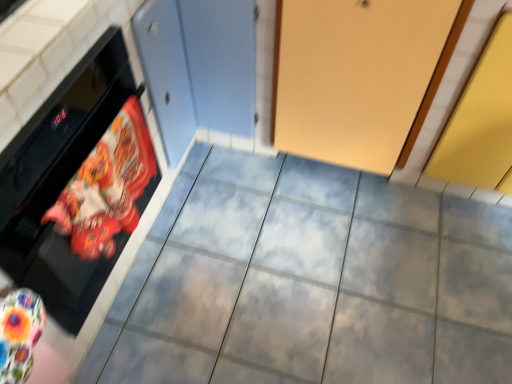
Question: Is printed fabric oven mitt at left turned away from matte gray tile at center?

Choices:
 (A) no
 (B) yes

Answer: (A)

Question: From the image's perspective, does printed fabric oven mitt at left appear lower than matte gray tile at center?

Choices:
 (A) no
 (B) yes

Answer: (A)

Question: Is printed fabric oven mitt at left taller than matte gray tile at center?

Choices:
 (A) yes
 (B) no

Answer: (A)

Question: Is the surface of printed fabric oven mitt at left in direct contact with matte gray tile at center?

Choices:
 (A) no
 (B) yes

Answer: (A)

Question: Is printed fabric oven mitt at left further to camera compared to matte gray tile at center?

Choices:
 (A) yes
 (B) no

Answer: (B)

Question: From the image's perspective, is printed fabric oven mitt at left on top of matte gray tile at center?

Choices:
 (A) no
 (B) yes

Answer: (B)

Question: Is black glossy oven at left wider than printed fabric oven mitt at left?

Choices:
 (A) no
 (B) yes

Answer: (B)

Question: From a real-world perspective, does black glossy oven at left stand above printed fabric oven mitt at left?

Choices:
 (A) no
 (B) yes

Answer: (A)

Question: From the image's perspective, is black glossy oven at left under printed fabric oven mitt at left?

Choices:
 (A) no
 (B) yes

Answer: (A)

Question: Considering the relative sizes of black glossy oven at left and printed fabric oven mitt at left in the image provided, is black glossy oven at left thinner than printed fabric oven mitt at left?

Choices:
 (A) yes
 (B) no

Answer: (B)

Question: Considering the relative positions of black glossy oven at left and printed fabric oven mitt at left in the image provided, is black glossy oven at left in front of printed fabric oven mitt at left?

Choices:
 (A) no
 (B) yes

Answer: (B)

Question: Does black glossy oven at left have a greater height compared to printed fabric oven mitt at left?

Choices:
 (A) yes
 (B) no

Answer: (A)

Question: Is matte gray tile at center wider than printed fabric oven mitt at left?

Choices:
 (A) yes
 (B) no

Answer: (A)